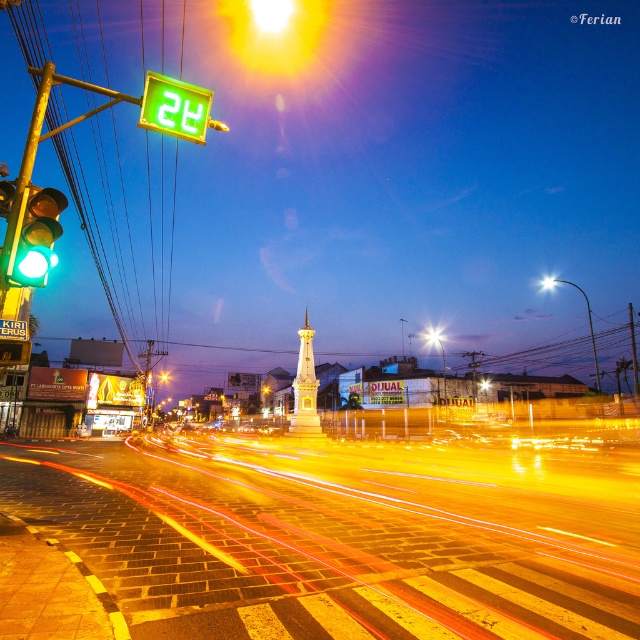
You are standing at the pedestrian crossing and see two points in the image. Which point is closer to you, point (593, 356) or point (436, 401)?

Point (593, 356) is further to the viewer than point (436, 401), so the closer point is point (436, 401).

You are a pedestrian standing at the pedestrian crossing. You notice the green matte traffic light at left and the white glossy street light at upper center. Which one is nearer to you?

The green matte traffic light at left is closer to the viewer than the white glossy street light at upper center.

You are a city planner trying to install a new traffic light between the white glossy street light at upper center and the white glossy street light at center. Given that the minimum required distance between traffic lights is 50 meters, will the existing spacing between these two street lights allow for this installation?

The white glossy street light at upper center and white glossy street light at center are 55.90 meters apart, which exceeds the minimum required distance of 50 meters. Therefore, the existing spacing allows for the installation of the new traffic light between them.